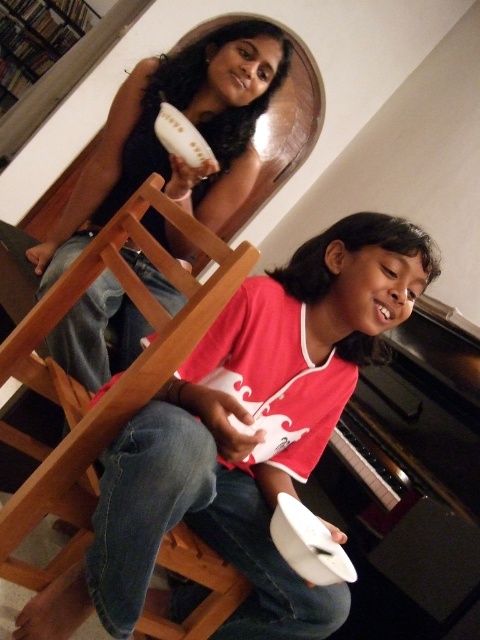
You are a photographer trying to capture a photo of both the point at coordinates (200,349) and the point at coordinates (147,285) in the scene. Which point should you focus on first to ensure both are in sharp focus?

Answer: You should focus on point (200,349) first because it is closer to the viewer than point (147,285), ensuring both points are within the depth of field.

You are setting up a small table for a snack. You have a white matte plate at center and a matte black hairbrush at upper center. Where should you place the hairbrush so it doesn

The white matte plate at center is below the matte black hairbrush at upper center, so the hairbrush should be placed above the plate to maintain their positions.

You are setting up a small table for a snack. You have a white matte plate at center and a matte black hairbrush at upper center. Which item should you move to make space for a cup?

You should move the matte black hairbrush at upper center to the left since the white matte plate at center is already positioned to its right, leaving space on the left side for the cup.